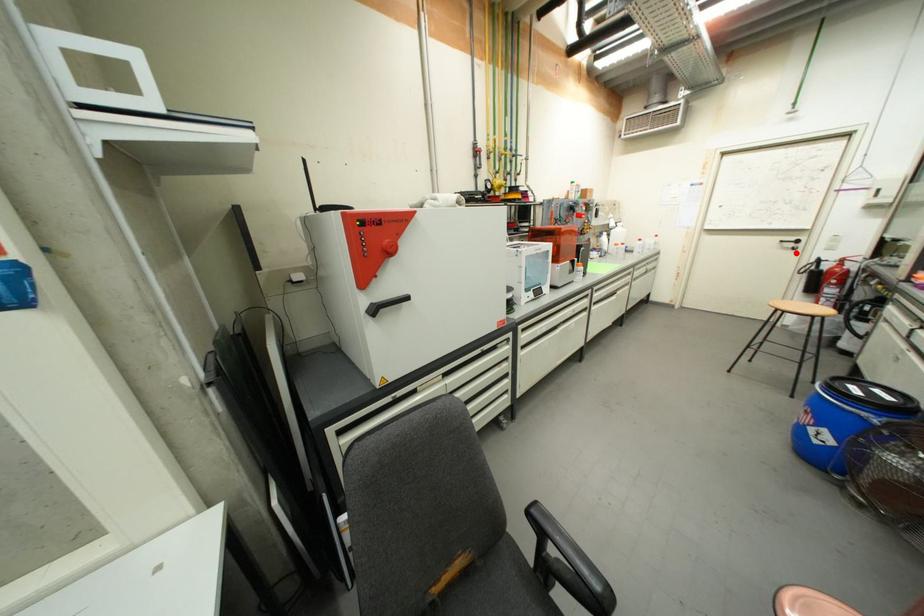
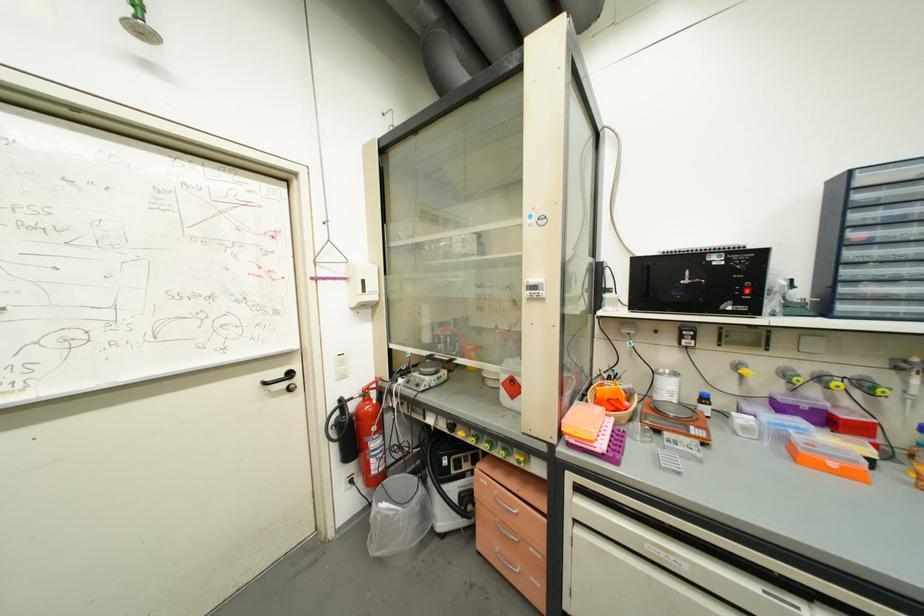
Find the pixel in the second image that matches the highlighted location in the first image.

(293, 398)